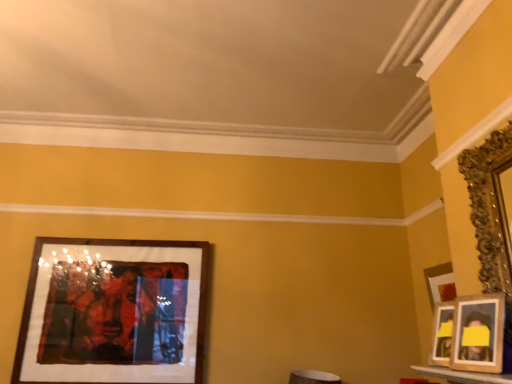
Question: Looking at their shapes, would you say wooden photo frame at right, which appears as the second picture frame when viewed from the front, is wider or thinner than gold ornate mirror at right, acting as the third picture frame starting from the back?

Choices:
 (A) thin
 (B) wide

Answer: (A)

Question: Is wooden photo frame at right, which appears as the second picture frame when viewed from the front, bigger or smaller than gold ornate mirror at right, acting as the third picture frame starting from the back?

Choices:
 (A) small
 (B) big

Answer: (A)

Question: Which object is the closest to the wooden frame at left, placed as the first picture frame when sorted from back to front?

Choices:
 (A) wooden photo frame at right, arranged as the 2th picture frame when viewed from the back
 (B) gold ornate mirror at right, acting as the third picture frame starting from the back
 (C) white glossy table at lower right

Answer: (C)

Question: Considering the real-world distances, which object is closest to the wooden frame at left, placed as the first picture frame when sorted from back to front?

Choices:
 (A) white glossy table at lower right
 (B) wooden photo frame at right, which appears as the second picture frame when viewed from the front
 (C) gold ornate mirror at right, acting as the third picture frame starting from the back

Answer: (A)